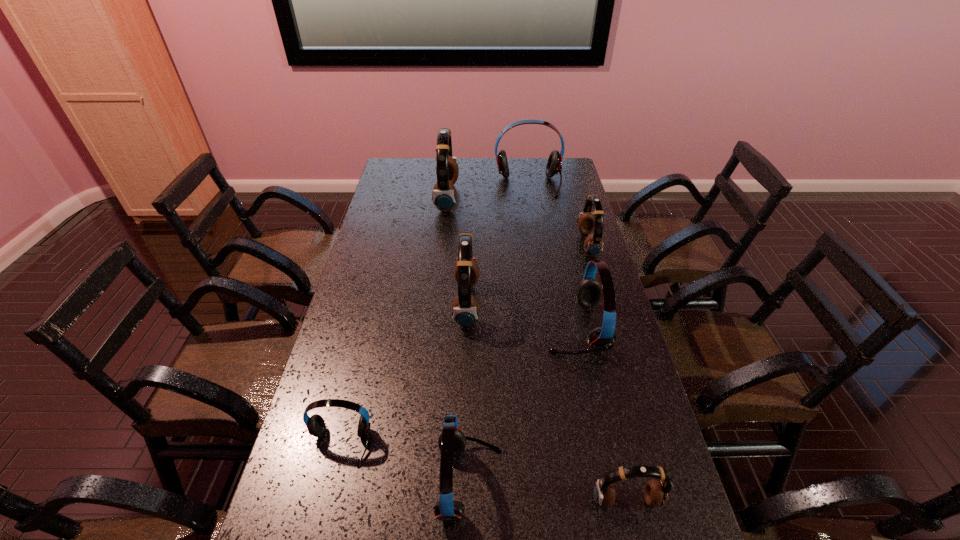
Identify the location of the leftmost object. (315, 424).

Find the location of a particular element. This screenshot has height=540, width=960. the leftmost headset is located at coordinates (315, 424).

I want to click on vacant position located on the ear cup of the biggest brown headset, so click(x=491, y=198).

This screenshot has width=960, height=540. What are the coordinates of `vacant space located 0.340m with the microphone attached to the side of the biggest red headset` in the screenshot? It's located at (539, 246).

Find the location of a particular element. This screenshot has height=540, width=960. free space located 0.290m on the ear cup of the third smallest brown headset is located at coordinates (569, 304).

Identify the location of vacant space located with the microphone attached to the side of the third smallest red headset. The image size is (960, 540). (463, 328).

The image size is (960, 540). I want to click on blank space located 0.370m with the microphone attached to the side of the third smallest red headset, so click(423, 328).

You are a GUI agent. You are given a task and a screenshot of the screen. Output one action in this format:
    pyautogui.click(x=<x>, y=<y>)
    Task: Click on the free spot located with the microphone attached to the side of the third smallest red headset
    
    Given the screenshot: What is the action you would take?
    pyautogui.click(x=443, y=328)

Locate an element on the screen. vacant area situated on the ear cup of the third farthest headset is located at coordinates (486, 245).

This screenshot has width=960, height=540. In order to click on vacant region located on the ear cup of the third farthest headset in this screenshot , I will do `click(483, 245)`.